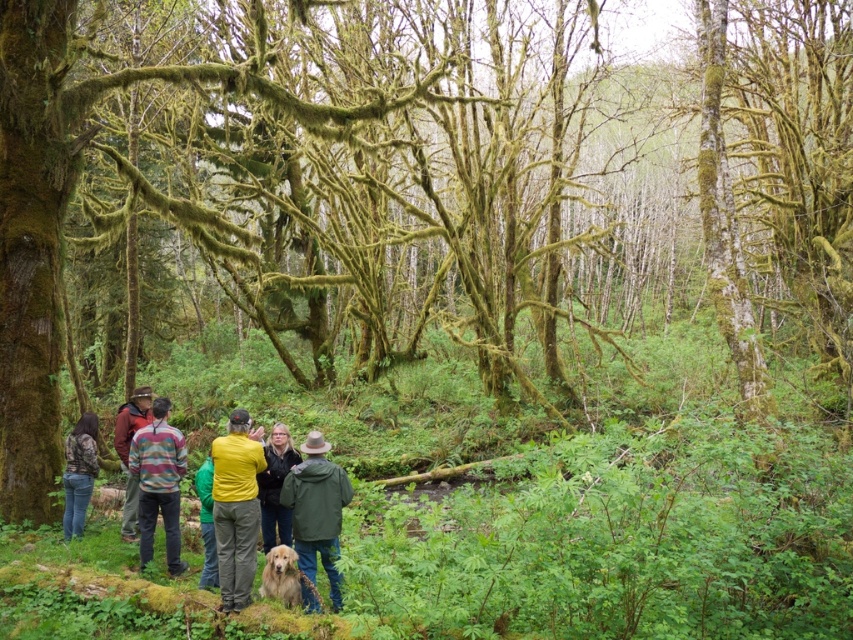
You are part of a group in a mossy forest and need to locate the yellow matte jacket at center quickly. Where should you look based on the coordinates provided?

The yellow matte jacket at center is located at coordinates point (236,508).

In the scene shown: You are part of the group in the forest and want to hand a compass to the person wearing the striped sweater at center and the green fuzzy sweater at center. Which one can you reach without moving closer?

You can reach the striped sweater at center first because it is closer to you than the green fuzzy sweater at center.